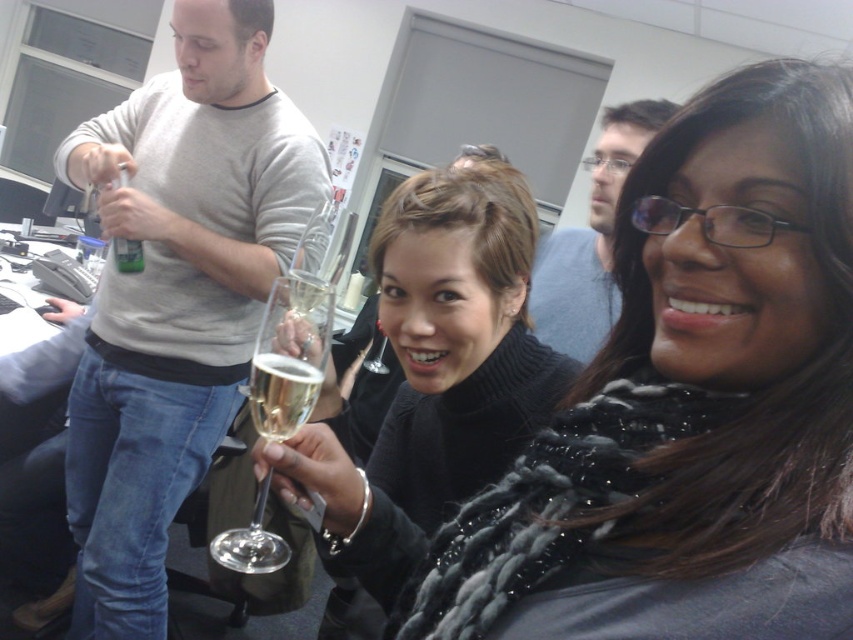
You are organizing a photo shoot and need to ensure that the black textured scarf at center and the gold metallic champagne glass at center are both visible in the frame. Given their sizes, which object might require more space horizontally to be fully captured?

The black textured scarf at center requires more horizontal space because its width surpasses that of the gold metallic champagne glass at center.

You are planning to place a 12 inch decorative ribbon between the black textured scarf at center and the gold metallic champagne glass at center. Based on the scene description, will the ribbon fit between them without overlapping either object?

The distance between the black textured scarf at center and the gold metallic champagne glass at center is 10.65 inches. Since the ribbon is 12 inches long, it will not fit between them without overlapping either object.